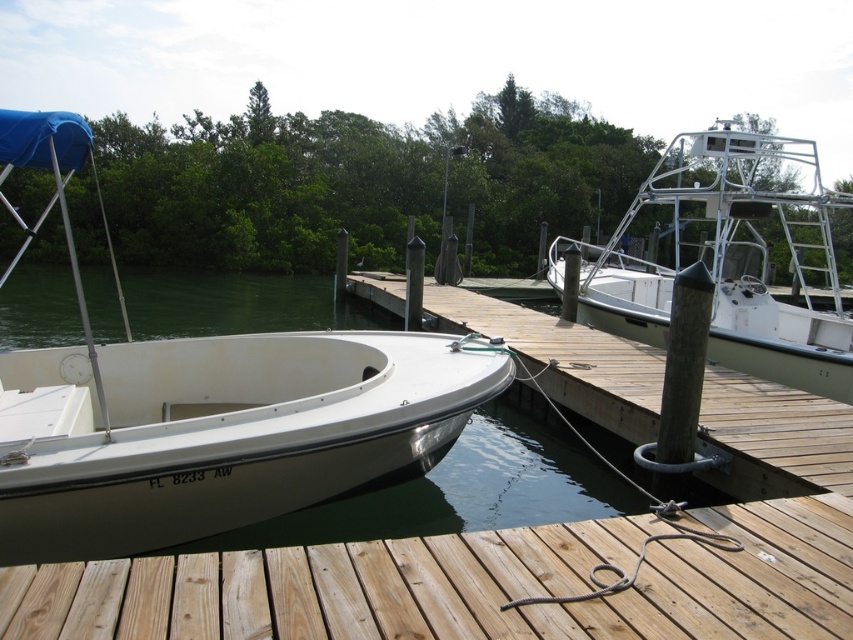
You are planning to dock your small boat that is 2 meters wide. You see the wooden dock at lower center and the white metallic boat at upper right. Which dock area can accommodate your boat based on their widths?

The white metallic boat at upper right is wider than the wooden dock at lower center, so the wooden dock at lower center cannot accommodate your 2 meter wide boat. The white metallic boat at upper right might be wider, but since its exact width isn answer provided, you cannot determine if it can fit. However, since the dock is narrower, it is unsuitable.

You are standing on the wooden pier and looking at the scene described. There is a point marked at coordinates [468,584]. What color is the material at this point?

The point at coordinates [468,584] corresponds to light brown wood at lower center, so the material there is light brown in color.